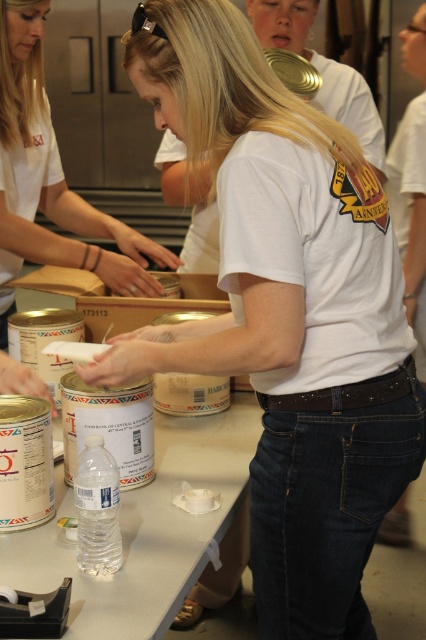
Which is in front, point (111, 272) or point (262, 13)?

Point (111, 272) is in front.

Consider the image. Does white matte shirt at center lie behind white matte t-shirt at center?

Yes.

Is point (40, 33) in front of point (382, 166)?

Yes, point (40, 33) is in front of point (382, 166).

The image size is (426, 640). Identify the location of white matte shirt at center. (55, 173).

Between clear plastic bottle at lower center and white matte t-shirt at center, which one has less height?

Standing shorter between the two is clear plastic bottle at lower center.

At what (x,y) coordinates should I click in order to perform the action: click on clear plastic bottle at lower center. Please return your answer as a coordinate pair (x, y). This screenshot has width=426, height=640. Looking at the image, I should click on (146, 529).

Does clear plastic bottle at lower center have a lesser height compared to white matte shirt at center?

Yes, clear plastic bottle at lower center is shorter than white matte shirt at center.

This screenshot has height=640, width=426. I want to click on clear plastic bottle at lower center, so click(146, 529).

Identify the location of clear plastic bottle at lower center. This screenshot has height=640, width=426. (146, 529).